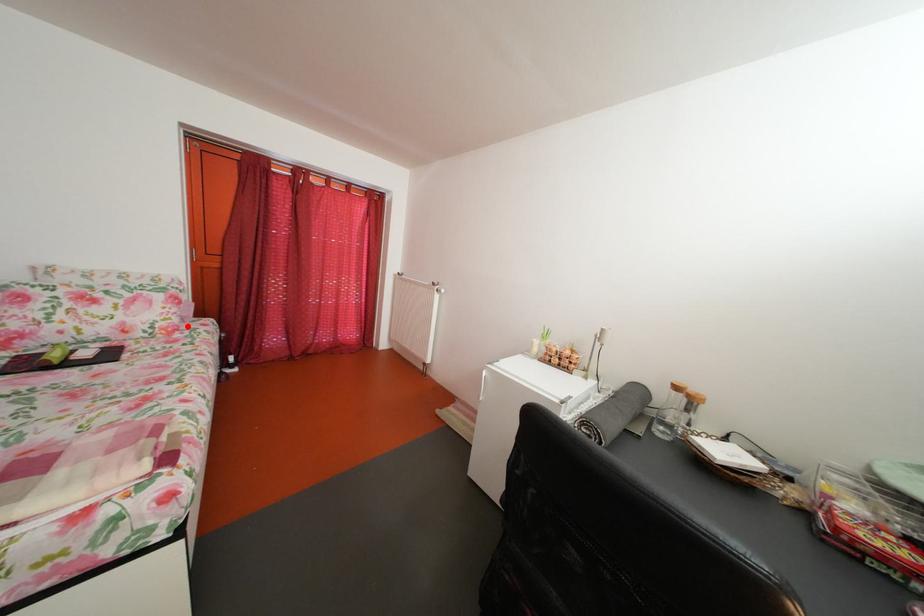
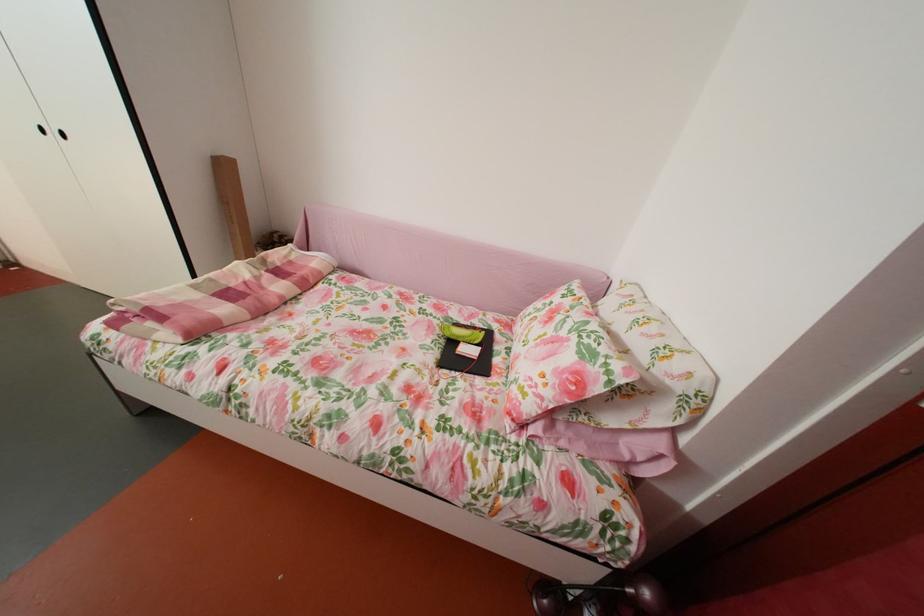
Where in the second image is the point corresponding to the highlighted location from the first image?

(541, 413)